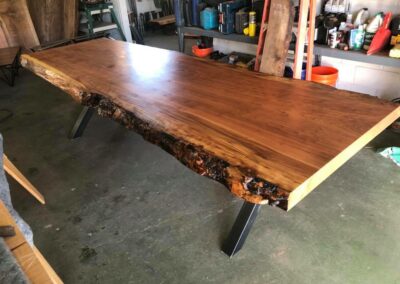
Identify the location of burnt part of wooden table. The image size is (400, 284). (184, 150).